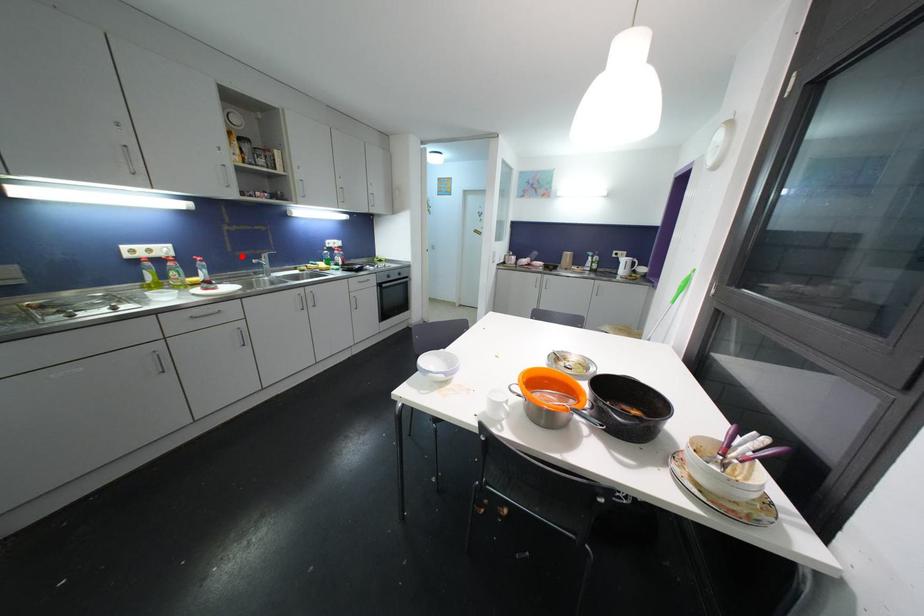
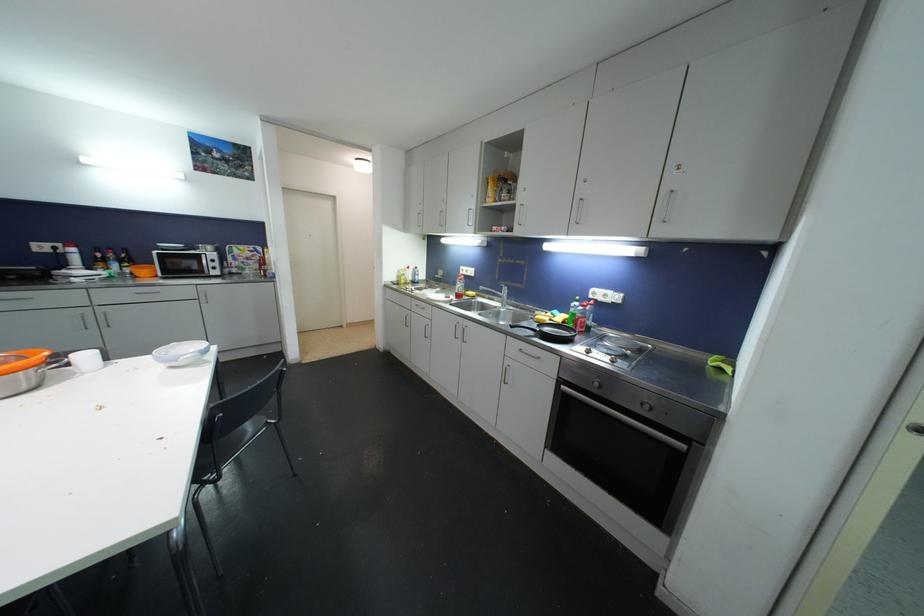
In the second image, find the point that corresponds to the highlighted location in the first image.

(504, 285)